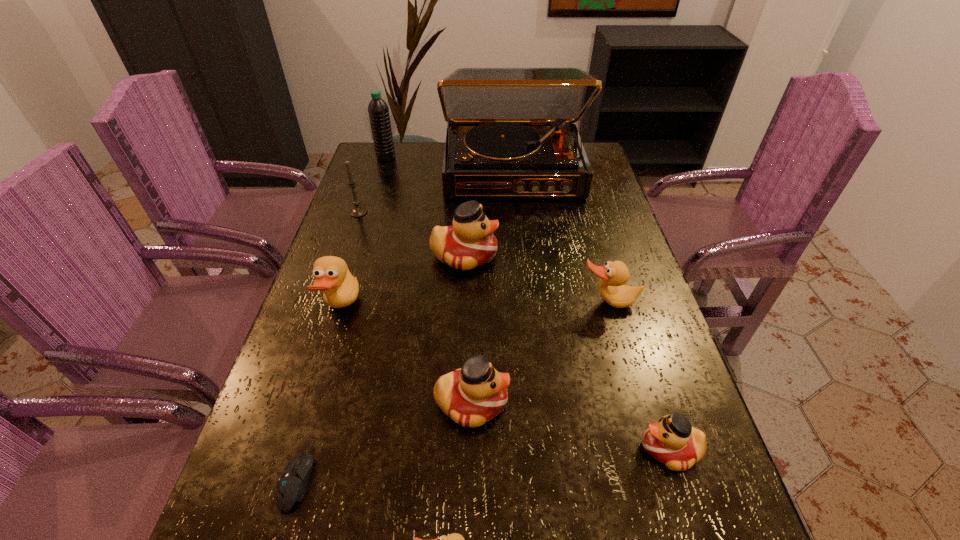
This screenshot has height=540, width=960. What are the coordinates of `the second closest red duck to the nearest tan duck` in the screenshot? It's located at (672, 441).

Identify which red duck is the nearest to the rightmost tan duck. Please provide its 2D coordinates. Your answer should be formatted as a tuple, i.e. [(x, y)], where the tuple contains the x and y coordinates of a point satisfying the conditions above.

[(469, 243)]

Select which tan duck appears as the third closest to the black water bottle. Please provide its 2D coordinates. Your answer should be formatted as a tuple, i.e. [(x, y)], where the tuple contains the x and y coordinates of a point satisfying the conditions above.

[(454, 539)]

Where is `tan duck that is the closest one to the rightmost red duck`? tan duck that is the closest one to the rightmost red duck is located at coordinates (613, 275).

Find the location of a particular element. This screenshot has height=540, width=960. free space that satisfies the following two spatial constraints: 1. on the front-facing side of the tallest object; 2. on the face of the second smallest red duck is located at coordinates (537, 403).

Where is `free location that satisfies the following two spatial constraints: 1. on the beak of the rightmost tan duck; 2. on the beak of the biggest tan duck`? The image size is (960, 540). free location that satisfies the following two spatial constraints: 1. on the beak of the rightmost tan duck; 2. on the beak of the biggest tan duck is located at coordinates (611, 308).